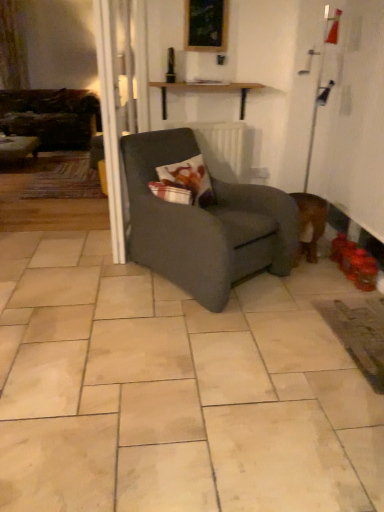
Find the location of `vacant space positioned to the left of white glossy screen door at left`. vacant space positioned to the left of white glossy screen door at left is located at coordinates (65, 245).